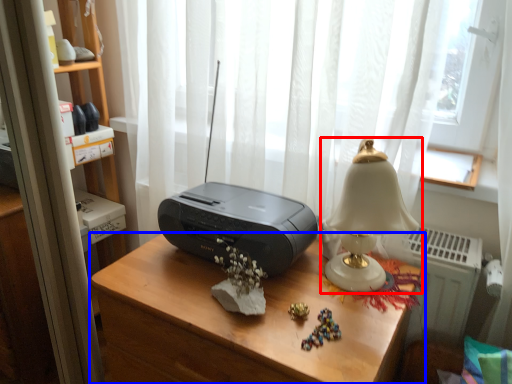
Question: Among these objects, which one is farthest to the camera, lamp (highlighted by a red box) or desk (highlighted by a blue box)?

Choices:
 (A) lamp
 (B) desk

Answer: (A)